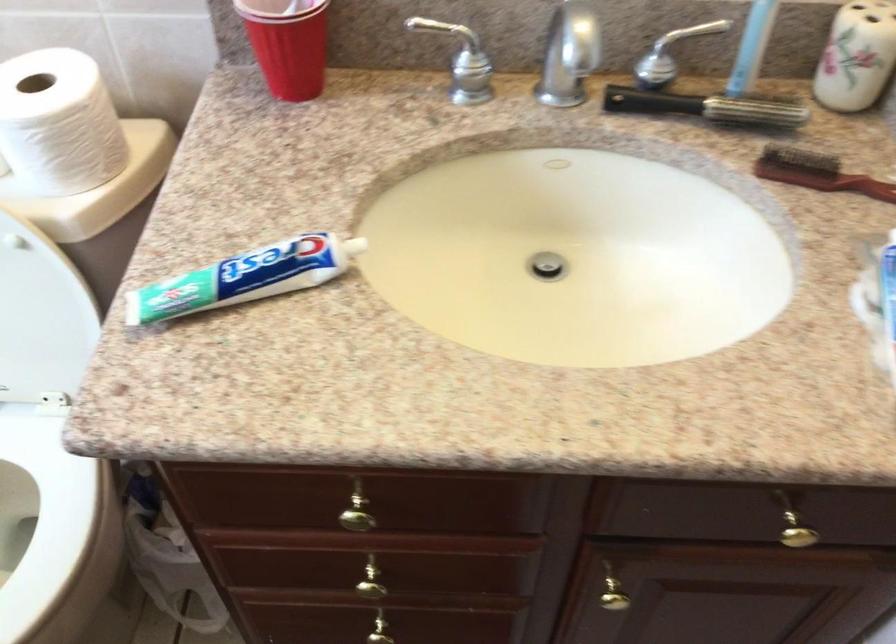
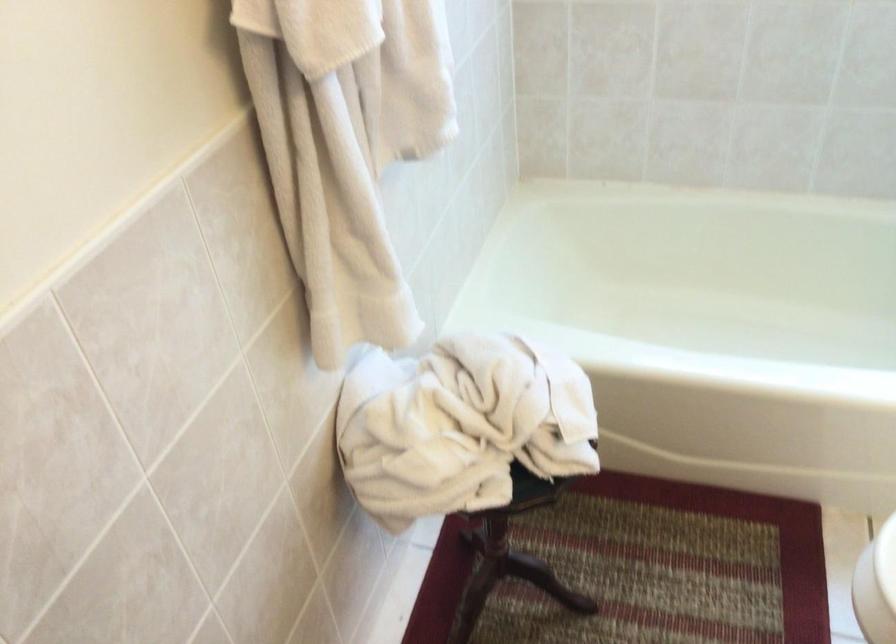
The first image is from the beginning of the video and the second image is from the end. How did the camera likely rotate when shooting the video?

The rotation direction of the camera is left-down.